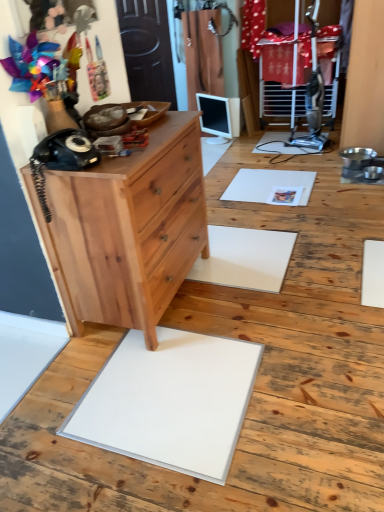
The width and height of the screenshot is (384, 512). Describe the element at coordinates (61, 158) in the screenshot. I see `black matte rotary phone at left` at that location.

I want to click on natural wood dresser at left, so click(x=256, y=378).

Is natural wood dresser at left turned away from black matte rotary phone at left?

No, natural wood dresser at left is not facing away from black matte rotary phone at left.

Is natural wood dresser at left positioned far away from black matte rotary phone at left?

natural wood dresser at left is actually quite close to black matte rotary phone at left.

Based on their positions, is natural wood dresser at left located to the left or right of black matte rotary phone at left?

Clearly, natural wood dresser at left is on the right of black matte rotary phone at left in the image.

How many degrees apart are the facing directions of black matte rotary phone at left and natural wood chest of drawers at left?

The angle between the facing direction of black matte rotary phone at left and the facing direction of natural wood chest of drawers at left is 12.9 degrees.

Considering the positions of objects black matte rotary phone at left and natural wood chest of drawers at left in the image provided, who is more to the left, black matte rotary phone at left or natural wood chest of drawers at left?

black matte rotary phone at left.

Considering the relative sizes of black matte rotary phone at left and natural wood chest of drawers at left in the image provided, is black matte rotary phone at left thinner than natural wood chest of drawers at left?

Correct, the width of black matte rotary phone at left is less than that of natural wood chest of drawers at left.

Locate an element on the screen. The width and height of the screenshot is (384, 512). equipment on the left of natural wood dresser at left is located at coordinates (61, 158).

Considering their positions, is black matte rotary phone at left located in front of or behind natural wood dresser at left?

black matte rotary phone at left is positioned closer to the viewer than natural wood dresser at left.

From the image's perspective, is black matte rotary phone at left under natural wood dresser at left?

Yes, from the image's perspective, black matte rotary phone at left is below natural wood dresser at left.

Is black matte rotary phone at left at the back of natural wood chest of drawers at left?

natural wood chest of drawers at left does not have its back to black matte rotary phone at left.

Between natural wood chest of drawers at left and black matte rotary phone at left, which one is positioned in front?

black matte rotary phone at left is closer to the camera.

From the image's perspective, which is above, natural wood chest of drawers at left or black matte rotary phone at left?

black matte rotary phone at left appears higher in the image.

The image size is (384, 512). Identify the location of chest of drawers on the right of black matte rotary phone at left. (127, 228).

From a real-world perspective, is natural wood dresser at left on natural wood chest of drawers at left?

Actually, natural wood dresser at left is physically below natural wood chest of drawers at left in the real world.

From the image's perspective, between natural wood dresser at left and natural wood chest of drawers at left, who is located below?

natural wood chest of drawers at left appears lower in the image.

Is natural wood dresser at left far from natural wood chest of drawers at left?

Actually, natural wood dresser at left and natural wood chest of drawers at left are a little close together.

Considering the positions of point (347, 273) and point (48, 250), is point (347, 273) closer or farther from the camera than point (48, 250)?

Clearly, point (347, 273) is more distant from the camera than point (48, 250).

Does natural wood chest of drawers at left have a lesser height compared to natural wood dresser at left?

Incorrect, the height of natural wood chest of drawers at left does not fall short of that of natural wood dresser at left.

Is natural wood chest of drawers at left oriented towards natural wood dresser at left?

No, natural wood chest of drawers at left is not aimed at natural wood dresser at left.

Do you think natural wood chest of drawers at left is within natural wood dresser at left, or outside of it?

natural wood chest of drawers at left cannot be found inside natural wood dresser at left.

The image size is (384, 512). What are the coordinates of `hardwood above the black matte rotary phone at left (from the image's perspective)` in the screenshot? It's located at [256, 378].

You are a GUI agent. You are given a task and a screenshot of the screen. Output one action in this format:
    pyautogui.click(x=<x>, y=<y>)
    Task: Click on the chest of drawers that appears on the right of black matte rotary phone at left
    The image size is (384, 512).
    Given the screenshot: What is the action you would take?
    pos(127,228)

Considering their positions, is black matte rotary phone at left positioned closer to natural wood chest of drawers at left than natural wood dresser at left?

Among the two, black matte rotary phone at left is located nearer to natural wood chest of drawers at left.

Considering their positions, is natural wood chest of drawers at left positioned further to black matte rotary phone at left than natural wood dresser at left?

natural wood dresser at left.

From the image, which object appears to be farther from black matte rotary phone at left, natural wood dresser at left or natural wood chest of drawers at left?

natural wood dresser at left is positioned further to the anchor black matte rotary phone at left.

Looking at the image, which one is located closer to natural wood chest of drawers at left, natural wood dresser at left or black matte rotary phone at left?

black matte rotary phone at left is positioned closer to the anchor natural wood chest of drawers at left.

Looking at this image, considering their positions, is black matte rotary phone at left positioned closer to natural wood dresser at left than natural wood chest of drawers at left?

natural wood chest of drawers at left lies closer to natural wood dresser at left than the other object.

Considering their positions, is natural wood chest of drawers at left positioned further to natural wood dresser at left than black matte rotary phone at left?

black matte rotary phone at left.

Locate an element on the screen. chest of drawers between black matte rotary phone at left and natural wood dresser at left is located at coordinates (127, 228).